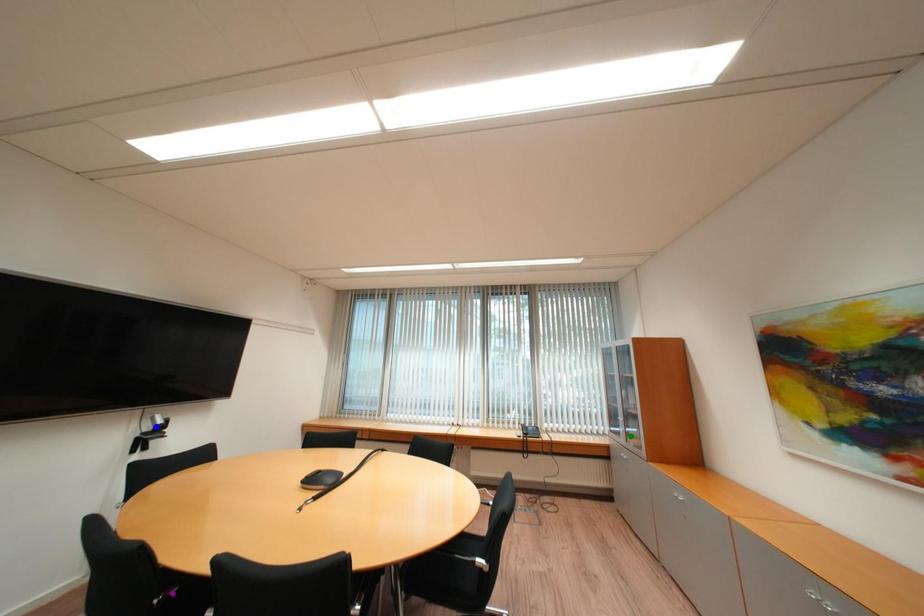
Order these from nearest to farthest:
blue point | green point | purple point

purple point, blue point, green point